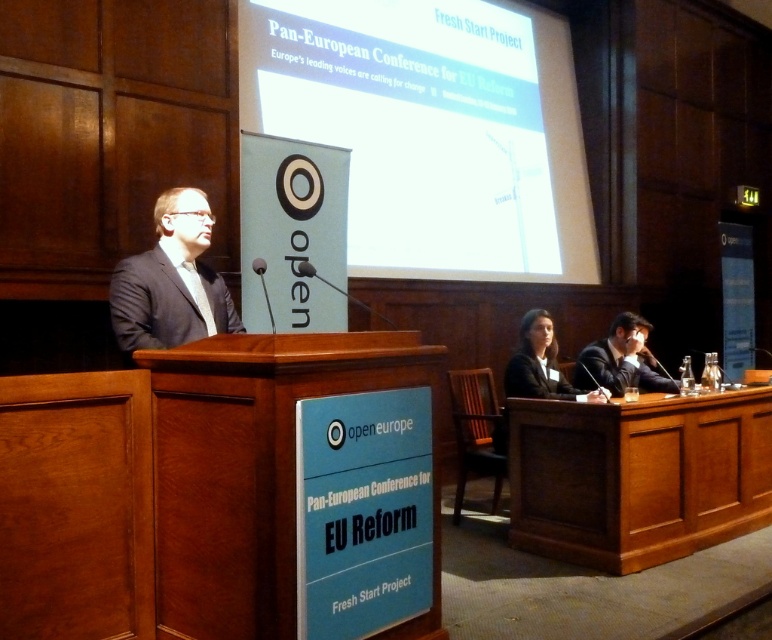
Question: Which point appears closest to the camera in this image?

Choices:
 (A) (557, 385)
 (B) (164, 232)

Answer: (B)

Question: From the image, what is the correct spatial relationship of white glossy projection screen at upper center in relation to black matte suit at center?

Choices:
 (A) left
 (B) right

Answer: (A)

Question: Is wooden table at right above black matte suit at lower right?

Choices:
 (A) no
 (B) yes

Answer: (A)

Question: Estimate the real-world distances between objects in this image. Which object is farther from the wooden table at right?

Choices:
 (A) black matte suit at lower right
 (B) white glossy projection screen at upper center
 (C) black fabric suit at center
 (D) black matte suit at center

Answer: (B)

Question: Which of the following is the closest to the observer?

Choices:
 (A) white glossy projection screen at upper center
 (B) black matte suit at lower right
 (C) black matte suit at center
 (D) black fabric suit at center

Answer: (D)

Question: Can you confirm if black matte suit at lower right is wider than black matte suit at center?

Choices:
 (A) yes
 (B) no

Answer: (A)